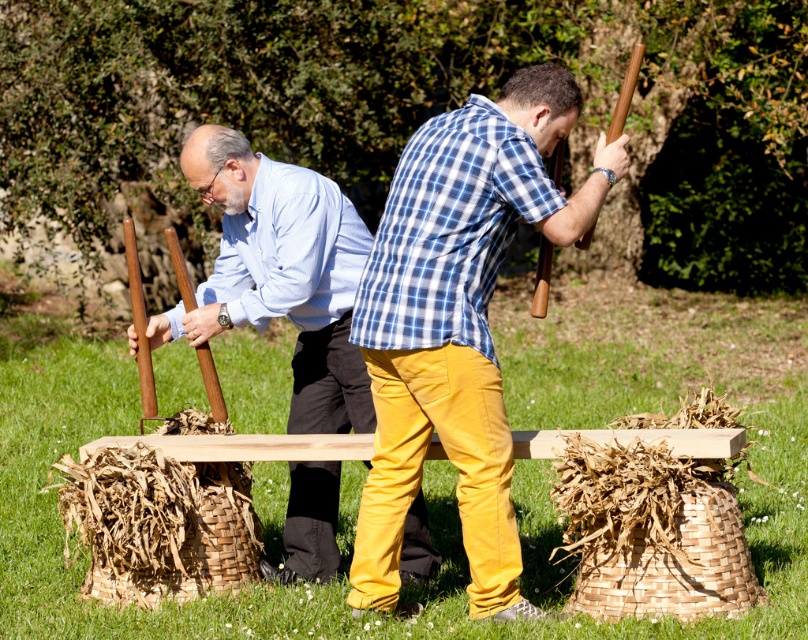
The image size is (808, 640). I want to click on matte brown wooden stick at center, so click(x=457, y=321).

Is matte brown wooden stick at center to the left of matte brown wooden stick at left from the viewer's perspective?

No, matte brown wooden stick at center is not to the left of matte brown wooden stick at left.

Does point (482, 180) lie behind point (314, 173)?

No.

I want to click on matte brown wooden stick at center, so click(x=457, y=321).